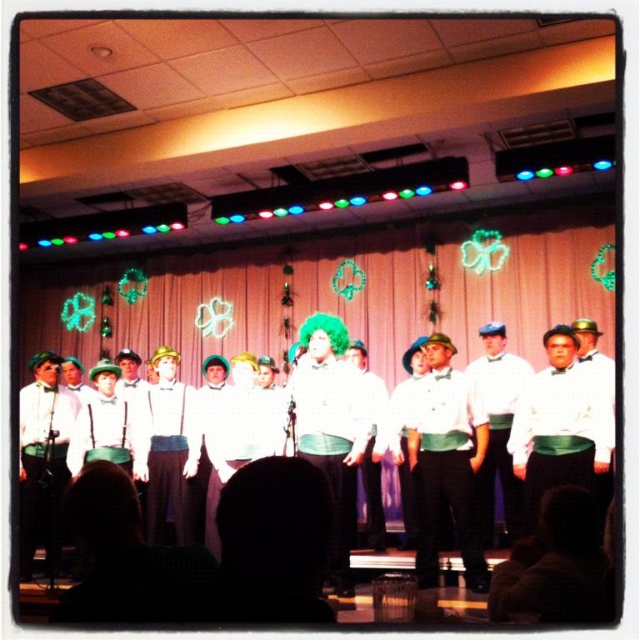
Question: Based on their relative distances, which object is farther from the white matte shirt at center?

Choices:
 (A) white fabric shirt at center
 (B) white satin bow tie at center

Answer: (A)

Question: Among these points, which one is farthest from the camera?

Choices:
 (A) [x=480, y=566]
 (B) [x=488, y=536]
 (C) [x=573, y=596]

Answer: (B)

Question: Is white fabric shirt at center further to camera compared to white matte shirt at center?

Choices:
 (A) yes
 (B) no

Answer: (B)

Question: Is white satin bow tie at center smaller than white matte shirt at center?

Choices:
 (A) yes
 (B) no

Answer: (A)

Question: Does white satin bow tie at center have a greater width compared to white matte shirt at center?

Choices:
 (A) yes
 (B) no

Answer: (B)

Question: Which object appears closest to the camera in this image?

Choices:
 (A) white matte shirt at center
 (B) white fabric shirt at center

Answer: (B)